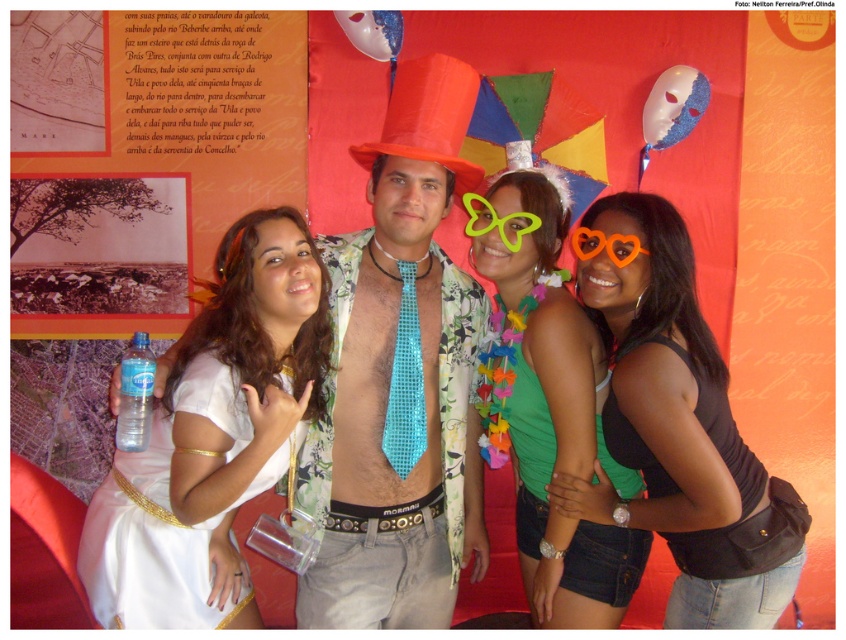
Question: Among these objects, which one is farthest from the camera?

Choices:
 (A) shiny blue tie at center
 (B) shiny plastic party hat at center
 (C) white satin dress at center

Answer: (B)

Question: Which object is the farthest from the green plastic butterfly at center?

Choices:
 (A) white satin dress at center
 (B) shiny blue tie at center
 (C) shiny plastic party hat at center
 (D) green fabric top at center

Answer: (A)

Question: Does shiny blue tie at center have a larger size compared to white satin dress at center?

Choices:
 (A) yes
 (B) no

Answer: (A)

Question: Can you confirm if shiny blue tie at center is positioned to the right of white satin dress at center?

Choices:
 (A) yes
 (B) no

Answer: (A)

Question: Where is black fabric tank top at right located in relation to shiny plastic party hat at center in the image?

Choices:
 (A) below
 (B) above

Answer: (A)

Question: Among these points, which one is farthest from the camera?

Choices:
 (A) (155, 531)
 (B) (515, 310)
 (C) (504, 234)
 (D) (407, 60)

Answer: (D)